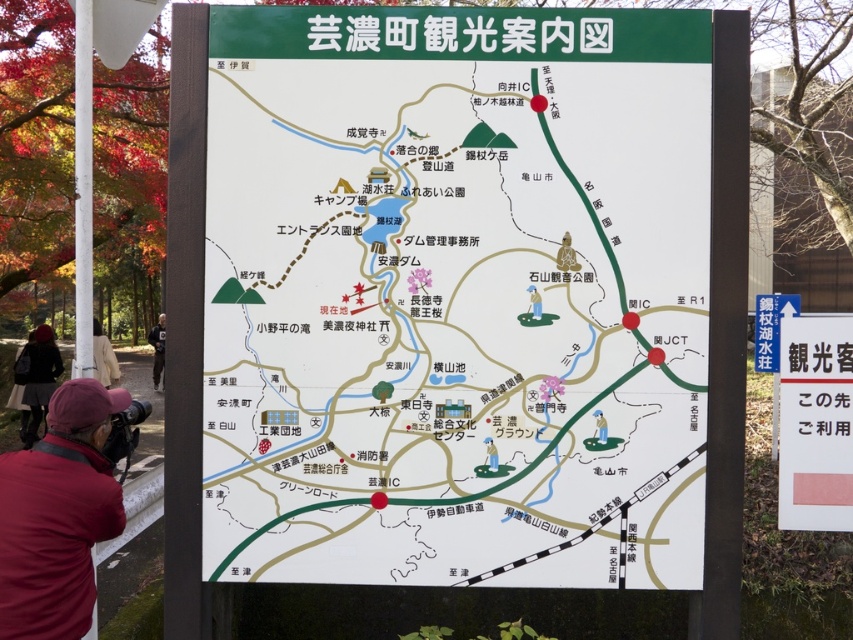
Can you confirm if dark brown leather jacket at lower left is positioned below green plastic golf club at center?

Yes.

Is dark brown leather jacket at lower left thinner than green plastic golf club at center?

In fact, dark brown leather jacket at lower left might be wider than green plastic golf club at center.

Who is more distant from viewer, (33, 364) or (492, 470)?

The point (33, 364) is behind.

I want to click on dark brown leather jacket at lower left, so click(38, 378).

Can you confirm if dark brown leather jacket at lower left is positioned to the left of blue signboard at upper right?

Result: Yes, dark brown leather jacket at lower left is to the left of blue signboard at upper right.

How far apart are dark brown leather jacket at lower left and blue signboard at upper right?

They are 8.83 meters apart.

I want to click on dark brown leather jacket at lower left, so click(38, 378).

Find the location of `white paper sign at upper right`. white paper sign at upper right is located at coordinates (815, 422).

Who is more forward, (849, 490) or (38, 348)?

Point (849, 490) is in front.

I want to click on white paper sign at upper right, so click(x=815, y=422).